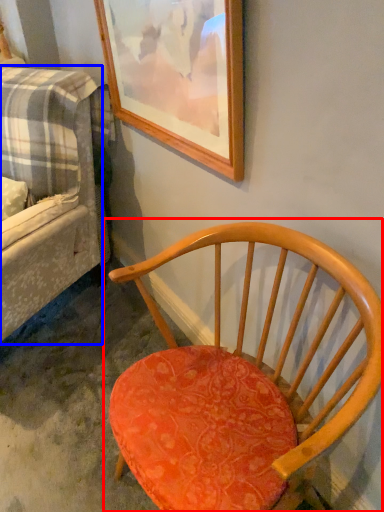
Question: Which point is further to the camera, chair (highlighted by a red box) or studio couch (highlighted by a blue box)?

Choices:
 (A) chair
 (B) studio couch

Answer: (B)